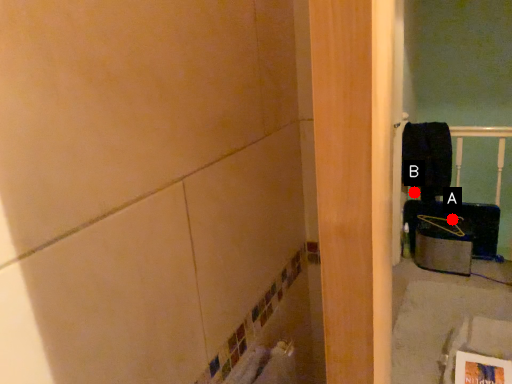
Question: Two points are circled on the image, labeled by A and B beside each circle. Which point appears farthest from the camera in this image?

Choices:
 (A) A is further
 (B) B is further

Answer: (B)